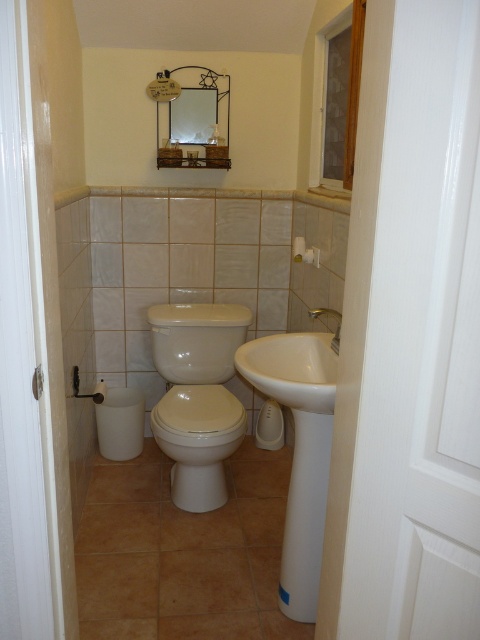
You are standing in the bathroom and need to place a new towel rack. The rack requires a minimum of 30 cm of space to the left and right. Given the white ceramic sink at center is at coordinates point 0.705, 0.623, can you install the rack next to it without violating the space requirements?

The white ceramic sink at center is located at point (299, 451). Since the coordinates indicate its position, but the exact spatial dimensions aren not provided, we cannot determine if there is sufficient space to install the rack without further information. However, based on standard sink dimensions, it might be possible if the bathroom layout allows. Consult the actual measurements for confirmation.

You are standing in the bathroom and need to clean the silver metallic faucet at upper right. Which object is directly above the white glossy toilet at center that you should focus on?

The silver metallic faucet at upper right is directly above the white glossy toilet at center, so you should focus on cleaning the silver metallic faucet at upper right.